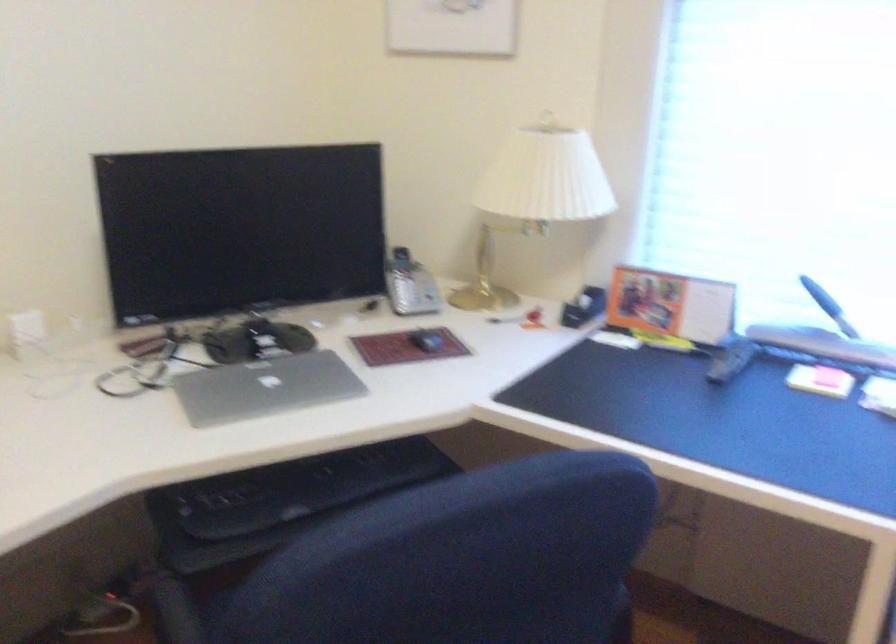
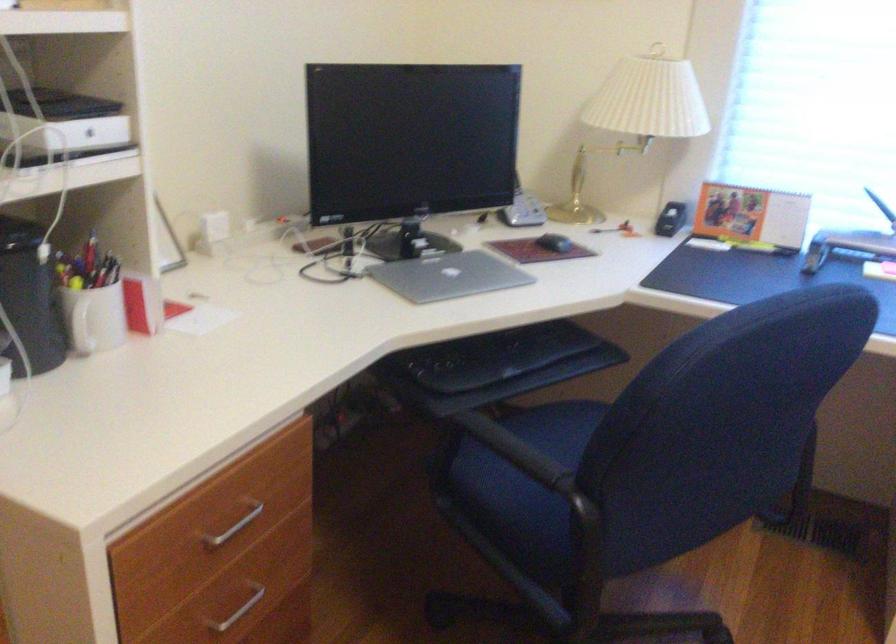
Where in the second image is the point corresponding to the point at 776,346 from the first image?

(847, 245)